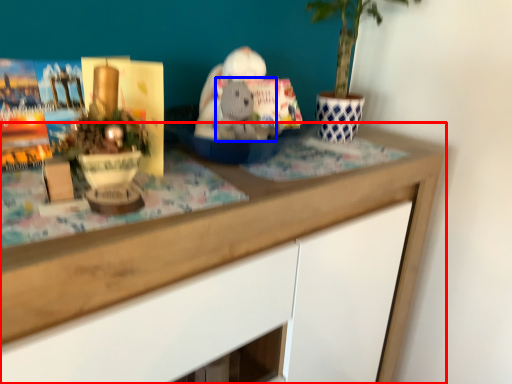
Question: Which point is further to the camera, desk (highlighted by a red box) or animal (highlighted by a blue box)?

Choices:
 (A) desk
 (B) animal

Answer: (B)